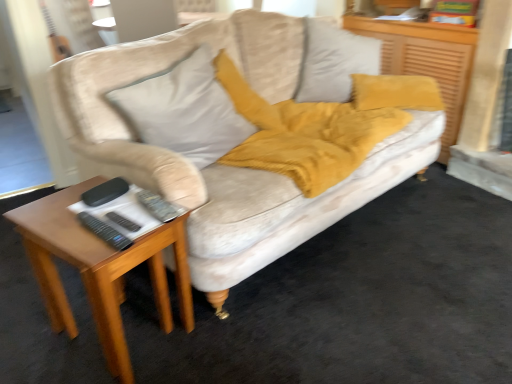
Identify the location of free space to the left of black plastic remote at lower left, the 1th remote when ordered from back to front. The image size is (512, 384). (62, 226).